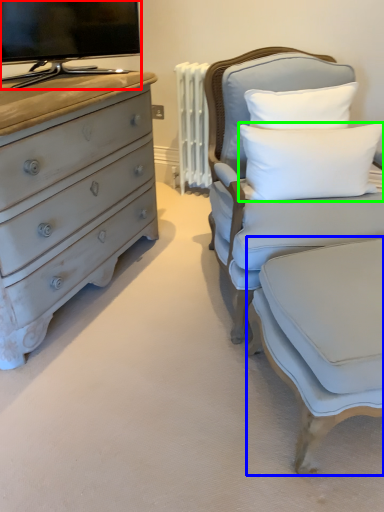
Question: Which object is positioned farthest from television (highlighted by a red box)? Select from swivel chair (highlighted by a blue box) and pillow (highlighted by a green box).

Choices:
 (A) swivel chair
 (B) pillow

Answer: (A)